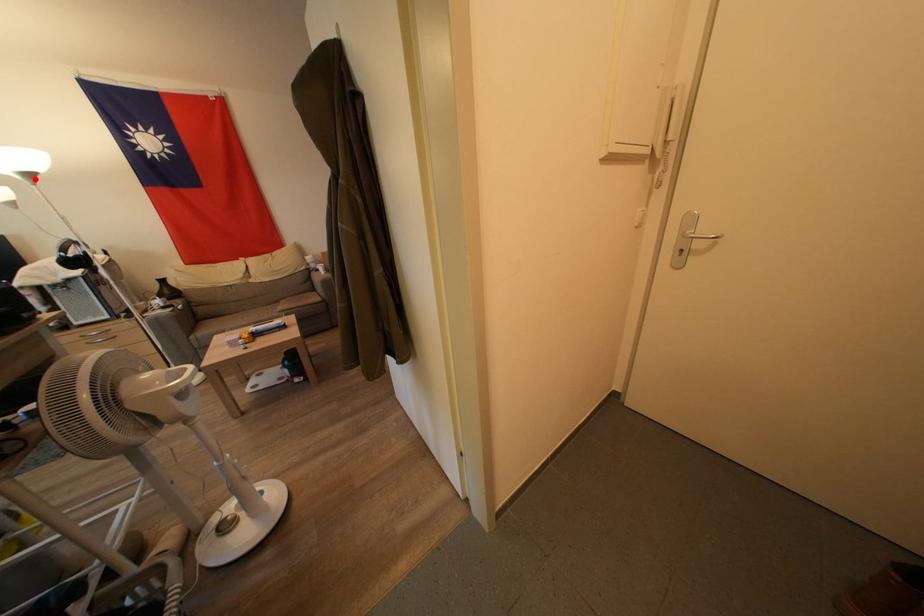
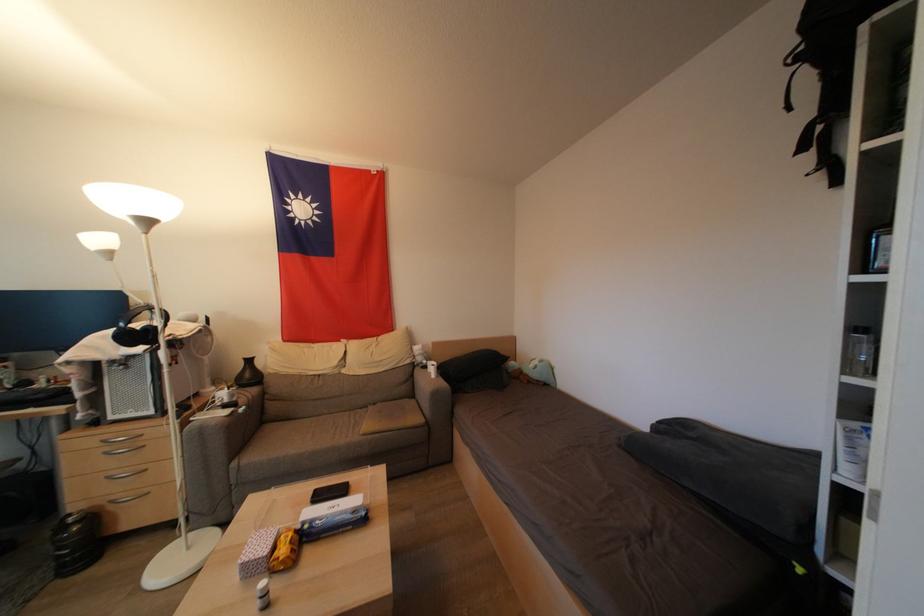
Find the pixel in the second image that matches the highlighted location in the first image.

(152, 225)